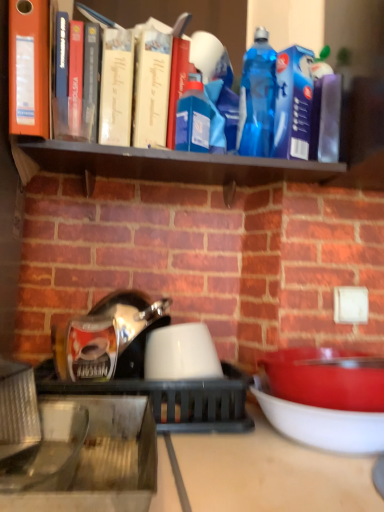
Question: Is matte white bowl at lower right, which is the 3th bowl from left to right, directly adjacent to black matte shelf at upper center?

Choices:
 (A) no
 (B) yes

Answer: (A)

Question: Is matte white bowl at lower right, which is the 3th bowl from left to right, to the left of black matte shelf at upper center from the viewer's perspective?

Choices:
 (A) no
 (B) yes

Answer: (A)

Question: Would you say black matte shelf at upper center is part of matte white bowl at lower right, the 1th bowl when ordered from right to left,'s contents?

Choices:
 (A) no
 (B) yes

Answer: (A)

Question: Is matte white bowl at lower right, the 1th bowl when ordered from right to left, smaller than black matte shelf at upper center?

Choices:
 (A) no
 (B) yes

Answer: (A)

Question: From the image's perspective, is matte white bowl at lower right, which is the 3th bowl from left to right, over black matte shelf at upper center?

Choices:
 (A) no
 (B) yes

Answer: (A)

Question: Is white glossy kettle at center situated inside black matte shelf at upper center or outside?

Choices:
 (A) inside
 (B) outside

Answer: (B)

Question: Is point (170, 423) closer or farther from the camera than point (269, 169)?

Choices:
 (A) closer
 (B) farther

Answer: (A)

Question: From the image's perspective, is white glossy kettle at center positioned above or below black matte shelf at upper center?

Choices:
 (A) below
 (B) above

Answer: (A)

Question: In terms of size, does white glossy kettle at center appear bigger or smaller than black matte shelf at upper center?

Choices:
 (A) big
 (B) small

Answer: (A)

Question: In the image, is black matte shelf at upper center positioned in front of or behind white glossy kettle at center?

Choices:
 (A) behind
 (B) front

Answer: (A)

Question: Looking at their shapes, would you say black matte shelf at upper center is wider or thinner than white glossy kettle at center?

Choices:
 (A) wide
 (B) thin

Answer: (B)

Question: Looking at the image, does black matte shelf at upper center seem bigger or smaller compared to white glossy kettle at center?

Choices:
 (A) small
 (B) big

Answer: (A)

Question: Would you say black matte shelf at upper center is to the left or to the right of white glossy kettle at center in the picture?

Choices:
 (A) right
 (B) left

Answer: (A)

Question: Is black matte shelf at upper center in front of or behind matte red bowl at right, the 2th bowl when ordered from right to left, in the image?

Choices:
 (A) behind
 (B) front

Answer: (A)

Question: Considering the positions of black matte shelf at upper center and matte red bowl at right, the second bowl when ordered from left to right, in the image, is black matte shelf at upper center taller or shorter than matte red bowl at right, the second bowl when ordered from left to right,?

Choices:
 (A) short
 (B) tall

Answer: (A)